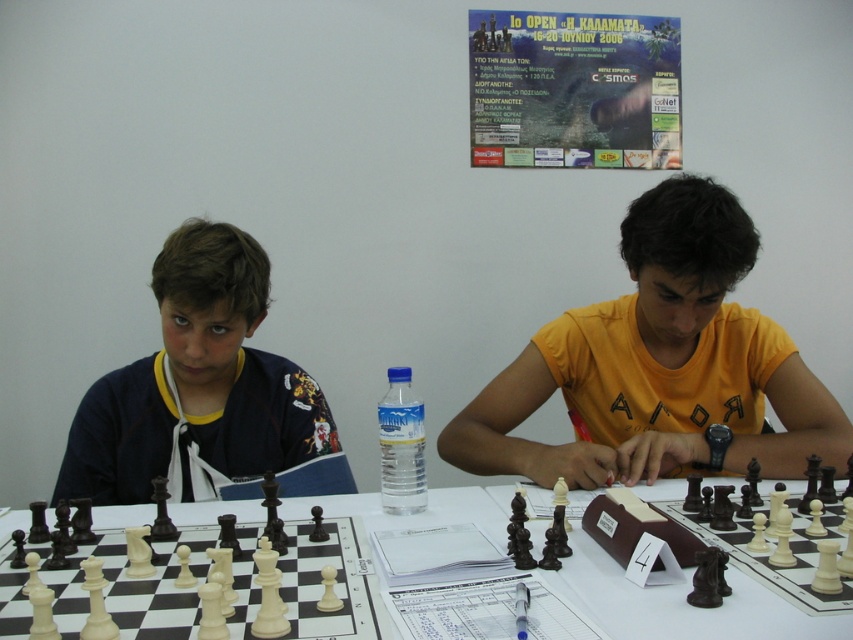
What is located at the coordinate point (659,364) in the image?

The point (659,364) is located on the orange cotton shirt at center.

You are standing in front of the chessboard and want to pick up the orange cotton shirt at center. Considering your arm can reach 1 meter, can you reach it?

The orange cotton shirt at center is 1.29 meters away from the viewer, which is beyond the arm reach of 1 meter. You cannot reach it.

You are a photographer standing in front of the scene. You want to take a photo of the paper poster at upper center and the white plastic table at center. Which object will appear larger in the photo?

The paper poster at upper center is taller than the white plastic table at center, so it will appear larger in the photo.